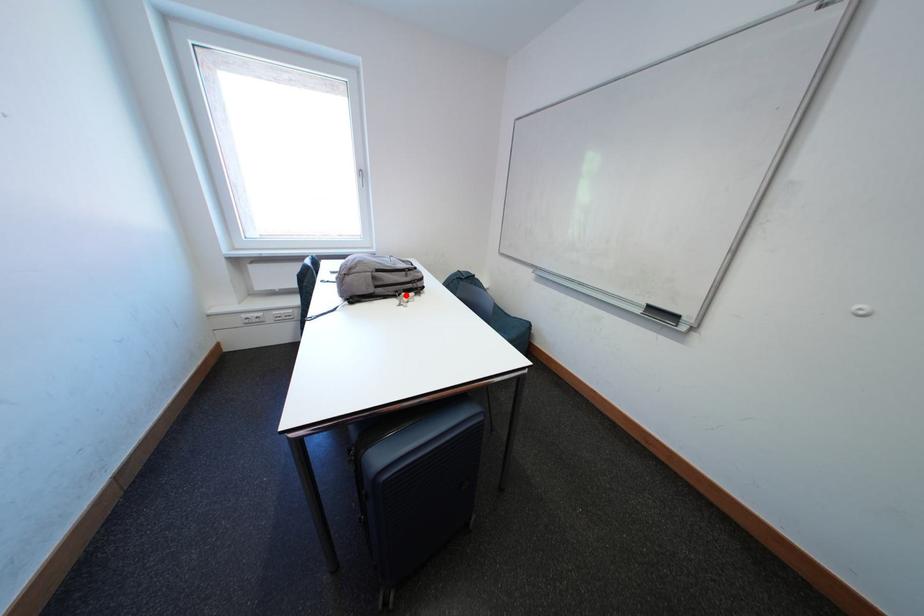
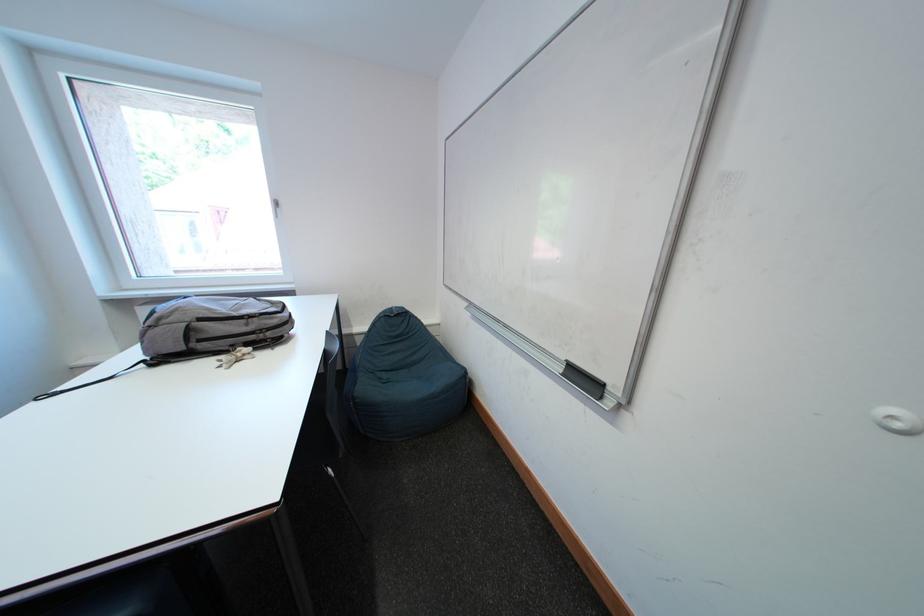
In the second image, find the point that corresponds to the highlighted location in the first image.

(241, 349)